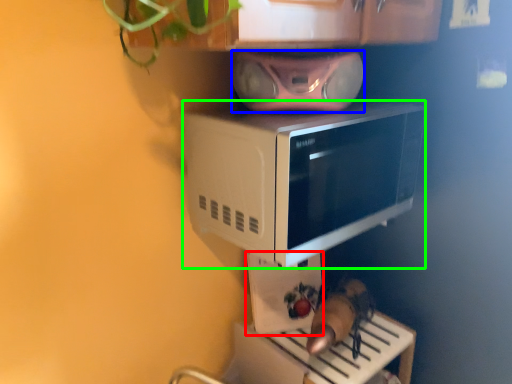
Question: Which object is the closest to the appliance (highlighted by a red box)? Choose among these: stereo (highlighted by a blue box) or microwave oven (highlighted by a green box).

Choices:
 (A) stereo
 (B) microwave oven

Answer: (A)